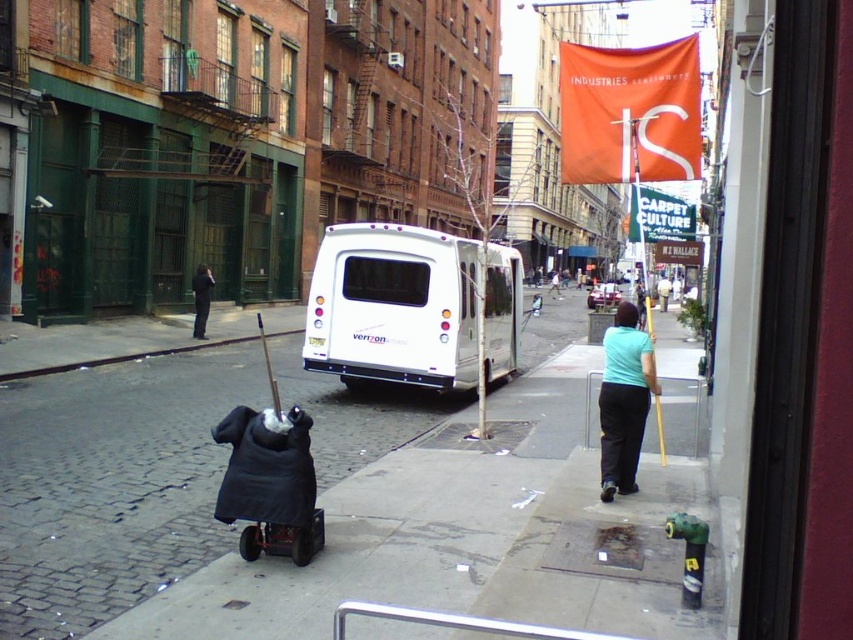
Question: Which object is positioned closest to the cobblestone pavement at center?

Choices:
 (A) white glossy van at center
 (B) black fabric baby carriage at lower left

Answer: (A)

Question: Can you confirm if cobblestone pavement at center is positioned to the left of white glossy van at center?

Choices:
 (A) no
 (B) yes

Answer: (A)

Question: Which object appears closest to the camera in this image?

Choices:
 (A) light blue t-shirt at center
 (B) cobblestone pavement at center
 (C) black fabric coat at center

Answer: (B)

Question: Which is farther from the black fabric coat at center?

Choices:
 (A) cobblestone pavement at center
 (B) white glossy van at center
 (C) black fabric baby carriage at lower left
 (D) light blue t-shirt at center

Answer: (C)

Question: Is cobblestone pavement at center smaller than light blue t-shirt at center?

Choices:
 (A) yes
 (B) no

Answer: (B)

Question: Does white glossy van at center have a smaller size compared to light blue t-shirt at center?

Choices:
 (A) no
 (B) yes

Answer: (A)